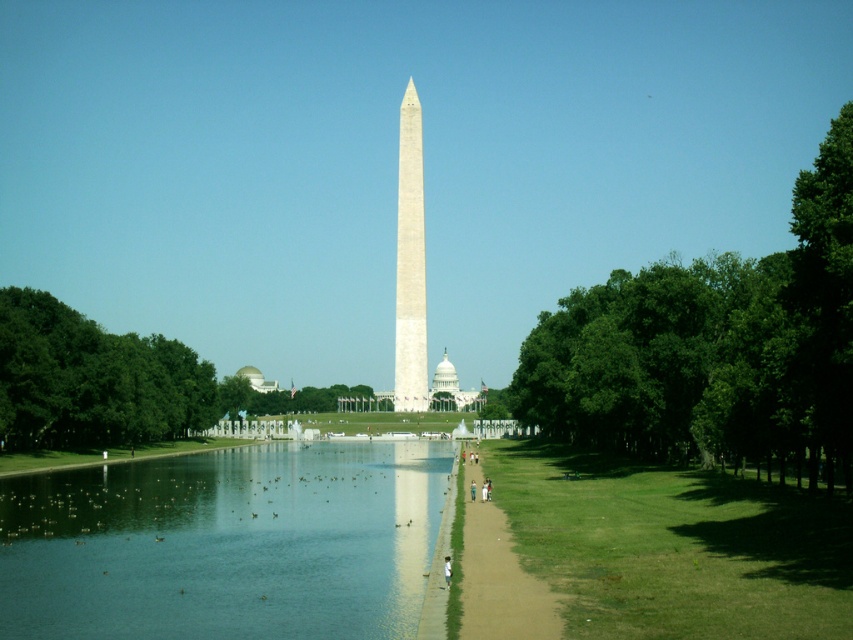
Identify the location of green leafy tree at left. The height and width of the screenshot is (640, 853). (91, 380).

Is green leafy tree at left closer to camera compared to white cotton shirt at center?

No, it is behind white cotton shirt at center.

The width and height of the screenshot is (853, 640). Describe the element at coordinates (91, 380) in the screenshot. I see `green leafy tree at left` at that location.

Find the location of a particular element. The height and width of the screenshot is (640, 853). green leafy tree at left is located at coordinates (91, 380).

Based on the photo, is brown dirt path at center above smooth concrete path at center?

Correct, brown dirt path at center is located above smooth concrete path at center.

Which is more to the left, brown dirt path at center or smooth concrete path at center?

smooth concrete path at center

The height and width of the screenshot is (640, 853). Find the location of `brown dirt path at center`. brown dirt path at center is located at coordinates (492, 573).

Does green leafy tree at right have a greater width compared to brown dirt path at center?

Yes.

Image resolution: width=853 pixels, height=640 pixels. In order to click on green leafy tree at right in this screenshot , I will do `click(712, 346)`.